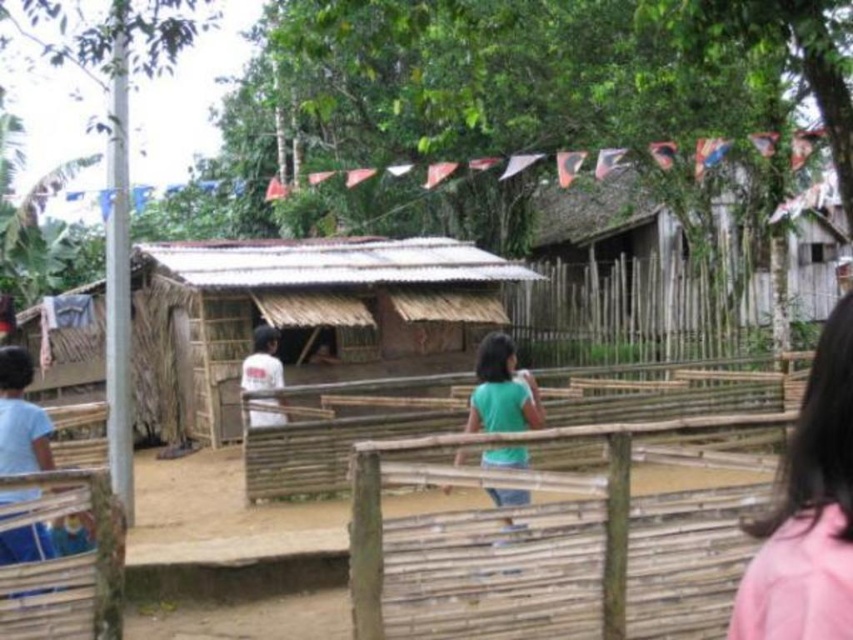
You are a visitor trying to see the entrance of the brown thatch hut at center but there are obstacles in the way. Which object from the scene might block your view of the entrance if you are standing behind the blue cotton shirt at left?

The blue cotton shirt at left might block your view of the entrance of the brown thatch hut at center because the brown thatch hut at center is shorter than the blue cotton shirt at left, making it possible that the shirt wearer is taller and could obstruct the line of sight.

You are standing at point (28, 544) and want to move to point (56, 369). Is the path directly between these two points clear of obstacles?

The path between point (56, 369) and point (28, 544) is clear because point (56, 369) is behind point (28, 544), indicating no obstruction between them.

You are standing at the entrance of the rustic wooden hut at upper right and want to walk towards the point marked at coordinate (645,292). Is this point directly in front of the rustic wooden hut at upper right?

The rustic wooden hut at upper right is located at point (645,292), so the point marked at coordinate (645,292) is directly in front of the rustic wooden hut at upper right.